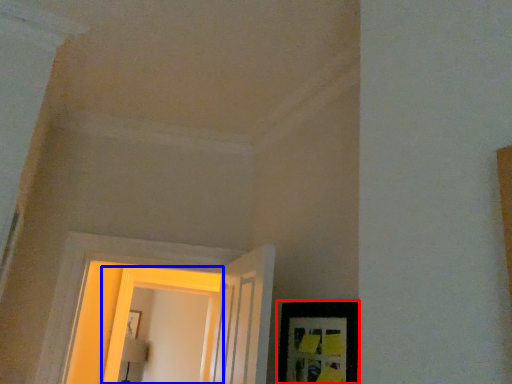
Question: Which object is further to the camera taking this photo, picture frame (highlighted by a red box) or window (highlighted by a blue box)?

Choices:
 (A) picture frame
 (B) window

Answer: (B)